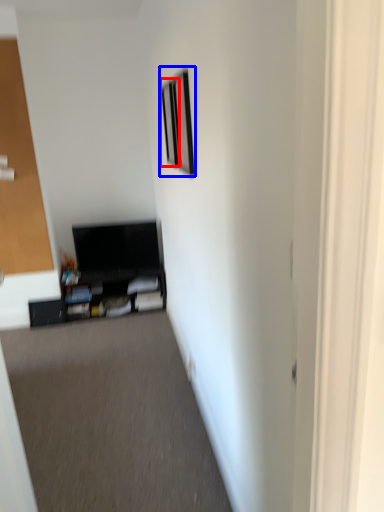
Question: Which object appears farthest to the camera in this image, picture frame (highlighted by a red box) or picture frame (highlighted by a blue box)?

Choices:
 (A) picture frame
 (B) picture frame

Answer: (A)